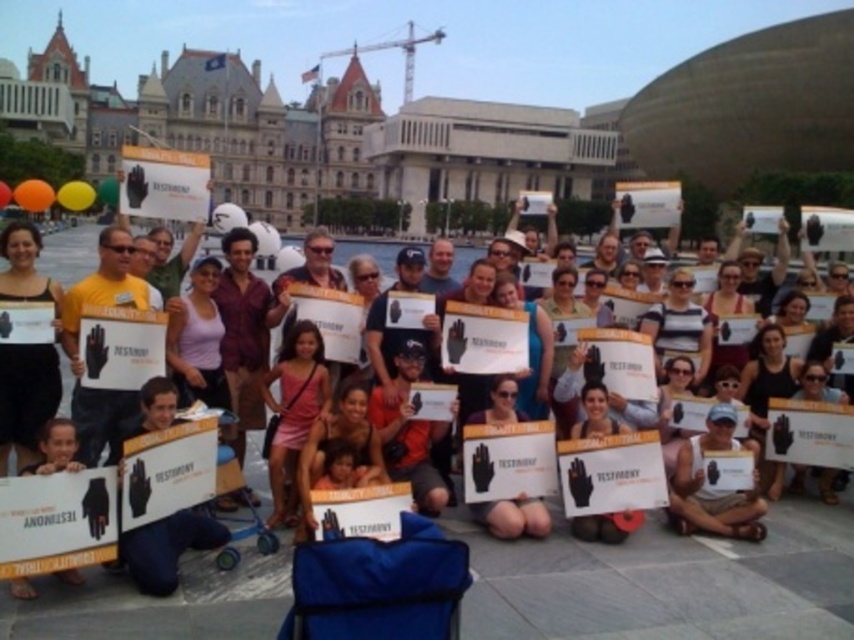
You are a photographer at the event and want to capture a photo of the white cotton tank top at center and the matte black hand at lower left. Which object will appear closer to the camera in the final photo?

The white cotton tank top at center will appear closer to the camera because it is positioned over the matte black hand at lower left, indicating it is in front spatially.

What is the color of the clothing item located at the coordinates point (712,490) in the image?

The white cotton tank top at center is represented by point (712,490), so the color is white.

You are a photographer trying to capture a clear shot of both the matte black sign at center and the matte black sign at lower left. Based on their positions, which sign should you adjust your camera to focus on first to ensure both are in frame?

The matte black sign at lower left should be focused on first since the matte black sign at center is to the right of it, allowing you to adjust your camera to include both signs in the frame by panning from left to right.